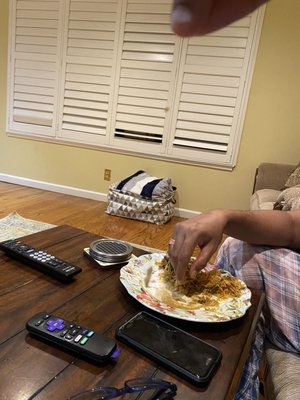
Identify the location of window cover. 207,97.